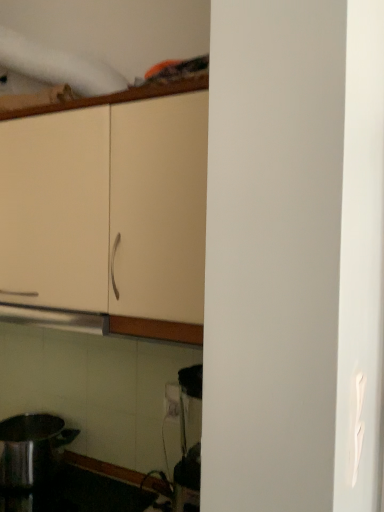
Question: From their relative heights in the image, would you say matte cream cabinet at upper left is taller or shorter than shiny metallic pot at lower left?

Choices:
 (A) short
 (B) tall

Answer: (B)

Question: Looking at their shapes, would you say matte cream cabinet at upper left is wider or thinner than shiny metallic pot at lower left?

Choices:
 (A) thin
 (B) wide

Answer: (B)

Question: From the image's perspective, is matte cream cabinet at upper left positioned above or below shiny metallic pot at lower left?

Choices:
 (A) above
 (B) below

Answer: (A)

Question: Is shiny metallic pot at lower left spatially inside matte cream cabinet at upper left, or outside of it?

Choices:
 (A) inside
 (B) outside

Answer: (B)

Question: Is shiny metallic pot at lower left wider or thinner than matte cream cabinet at upper left?

Choices:
 (A) wide
 (B) thin

Answer: (B)

Question: From the image's perspective, is shiny metallic pot at lower left above or below matte cream cabinet at upper left?

Choices:
 (A) below
 (B) above

Answer: (A)

Question: From their relative heights in the image, would you say shiny metallic pot at lower left is taller or shorter than matte cream cabinet at upper left?

Choices:
 (A) tall
 (B) short

Answer: (B)